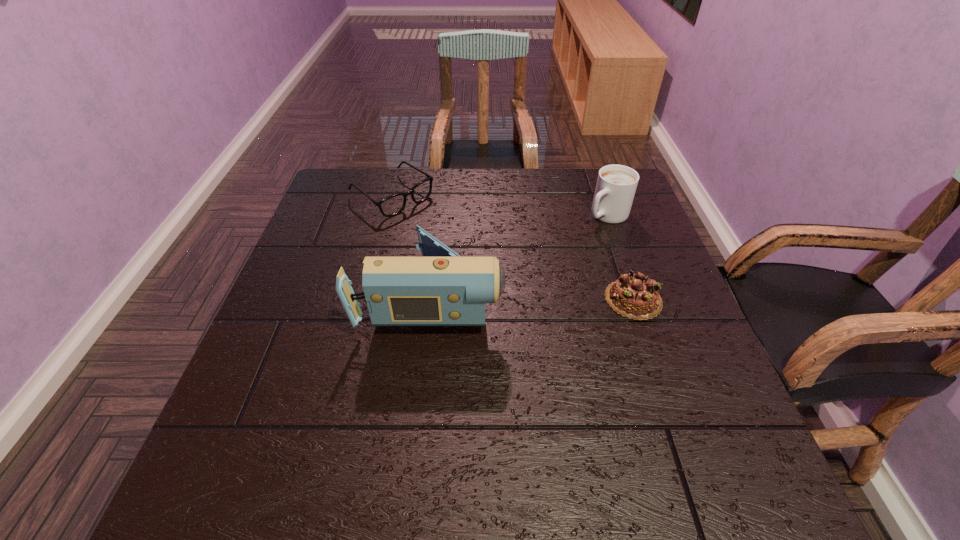
In order to click on vacant region at the near edge of the desktop in this screenshot , I will do `click(323, 404)`.

You are a GUI agent. You are given a task and a screenshot of the screen. Output one action in this format:
    pyautogui.click(x=<x>, y=<y>)
    Task: Click on the vacant space at the left edge of the desktop
    
    Given the screenshot: What is the action you would take?
    [x=311, y=239]

In the image, there is a desktop. Where is `vacant space at the right edge`? The image size is (960, 540). vacant space at the right edge is located at coordinates (704, 356).

Identify the location of free space at the far left corner. (372, 180).

Locate an element on the screen. The height and width of the screenshot is (540, 960). vacant space at the near left corner of the desktop is located at coordinates (299, 408).

Identify the location of free space between the third shortest object and the camcorder. (519, 255).

Locate an element on the screen. The height and width of the screenshot is (540, 960). free space between the spectacles and the cappuccino is located at coordinates (499, 205).

Locate an element on the screen. unoccupied area between the tallest object and the cappuccino is located at coordinates (519, 255).

Where is `vacant space that's between the cappuccino and the spectacles`? The height and width of the screenshot is (540, 960). vacant space that's between the cappuccino and the spectacles is located at coordinates (499, 205).

The height and width of the screenshot is (540, 960). In order to click on free spot between the spectacles and the chocolate cake in this screenshot , I will do `click(513, 247)`.